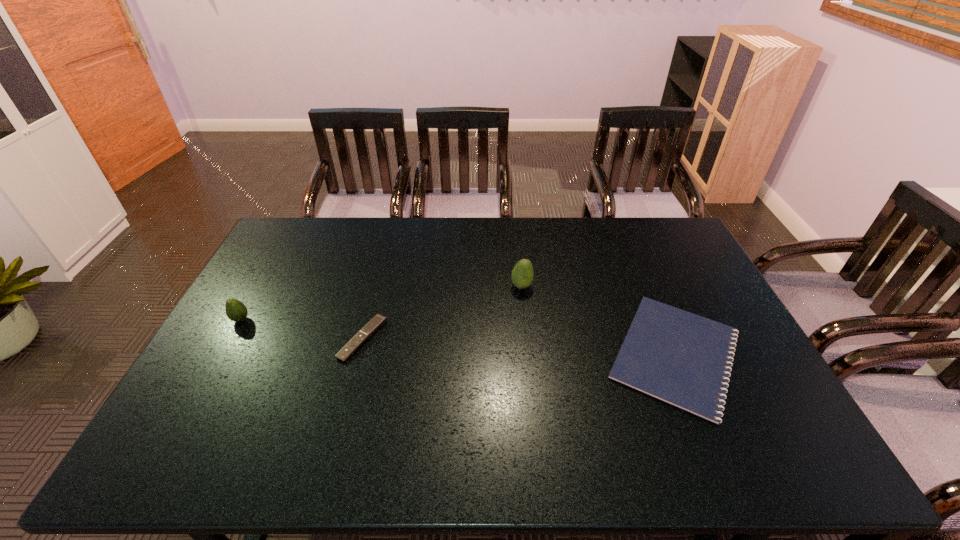
I want to click on free point that satisfies the following two spatial constraints: 1. on the front side of the leftmost object; 2. on the right side of the third tallest object, so click(229, 339).

The image size is (960, 540). What are the coordinates of `free point that satisfies the following two spatial constraints: 1. on the front side of the left avocado; 2. on the left side of the rightmost object` in the screenshot? It's located at (222, 354).